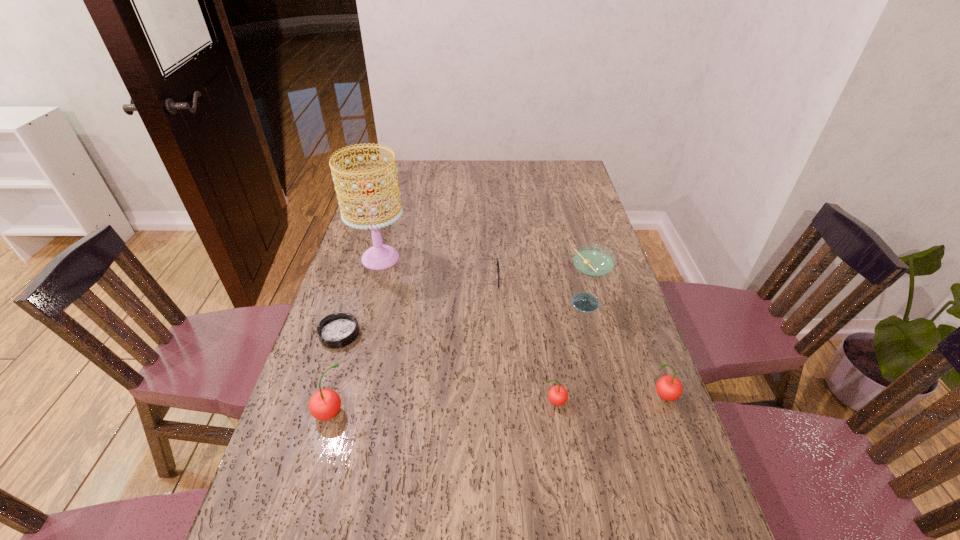
You are a GUI agent. You are given a task and a screenshot of the screen. Output one action in this format:
    pyautogui.click(x=<x>, y=<y>)
    Task: Click on the unoccupied area between the second tallest cherry and the leftmost cherry
    The width and height of the screenshot is (960, 540).
    Given the screenshot: What is the action you would take?
    pyautogui.click(x=496, y=405)

The image size is (960, 540). I want to click on free point between the second tallest cherry and the leftmost cherry, so click(x=496, y=405).

Where is `free space between the ashtray and the third shortest object`? The height and width of the screenshot is (540, 960). free space between the ashtray and the third shortest object is located at coordinates (446, 368).

Identify the location of free space between the spectacles and the martini. (532, 292).

Where is `free spot between the lampshade and the shortest cherry`? The width and height of the screenshot is (960, 540). free spot between the lampshade and the shortest cherry is located at coordinates (468, 330).

Image resolution: width=960 pixels, height=540 pixels. Identify the location of free space between the sixth object from left to right and the tallest cherry. (458, 359).

This screenshot has height=540, width=960. What are the coordinates of `empty space that is in between the second tallest cherry and the third tallest object` in the screenshot? It's located at (496, 405).

This screenshot has height=540, width=960. I want to click on blank region between the third tallest object and the second tallest cherry, so click(x=496, y=405).

Image resolution: width=960 pixels, height=540 pixels. I want to click on empty space that is in between the second shortest cherry and the third shortest object, so click(609, 399).

Locate which object ranks second in proximity to the second shortest object. Please provide its 2D coordinates. Your answer should be formatted as a tuple, i.e. [(x, y)], where the tuple contains the x and y coordinates of a point satisfying the conditions above.

[(592, 260)]